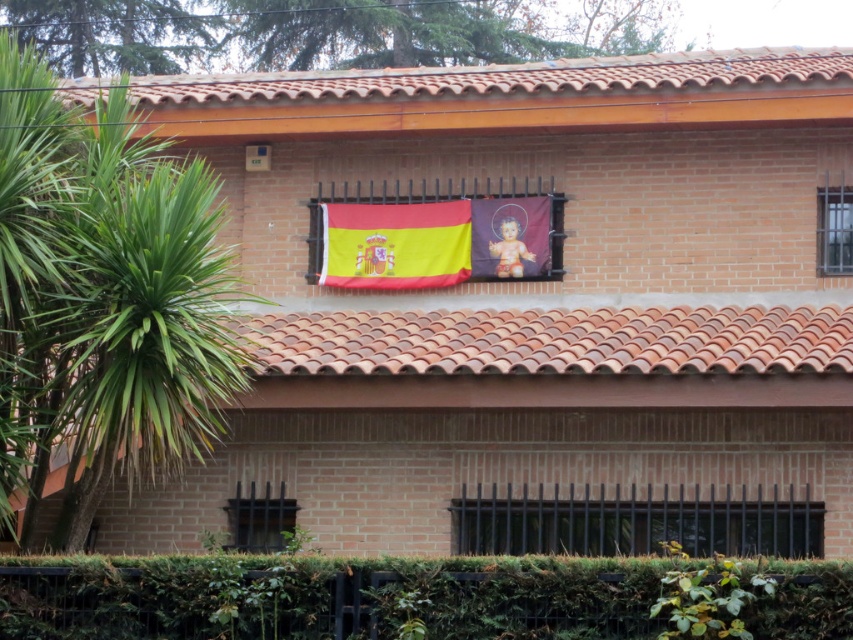
You are standing in front of the building and need to locate the terracotta tiles at center. According to the coordinate system where the bottom left corner is the origin, can you tell me their exact position?

The terracotta tiles at center are located at the coordinate point of [555,340].

You are a window cleaner standing on a platform that can only extend 3 meters from the building. You need to clean both the green leafy palm tree at left and the yellowmaterialflag at center. Can you reach both objects with the current platform extension?

A: The green leafy palm tree at left is 4.02 meters from the yellowmaterialflag at center. Since the platform can only extend 3 meters, you cannot reach the green leafy palm tree at left as it is beyond the platform extension range.

You are standing at the base of the building and want to place a 3.5 meter ladder between the green leafy palm tree at left and the black metal bars at lower center. Will the ladder fit without overlapping either object?

The distance between the green leafy palm tree at left and the black metal bars at lower center is 4.25 meters. Since the ladder is 3.5 meters long, it will fit without overlapping either object as there is enough space between them.